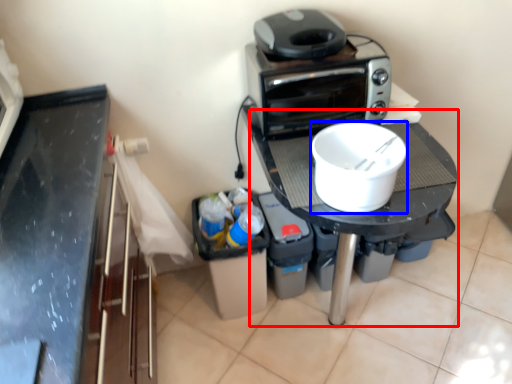
Question: Which object appears farthest to the camera in this image, table (highlighted by a red box) or kitchen appliance (highlighted by a blue box)?

Choices:
 (A) table
 (B) kitchen appliance

Answer: (A)